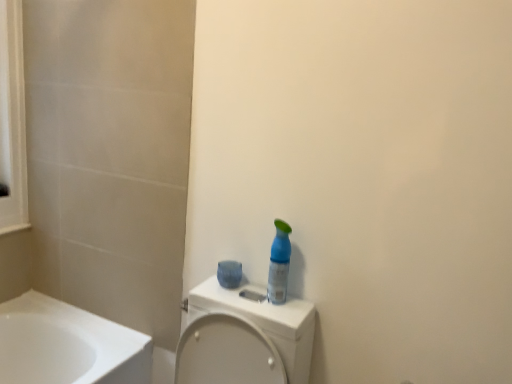
Where is `vacant area that lies to the right of transparent plastic spray bottle at center`? This screenshot has height=384, width=512. vacant area that lies to the right of transparent plastic spray bottle at center is located at coordinates (300, 301).